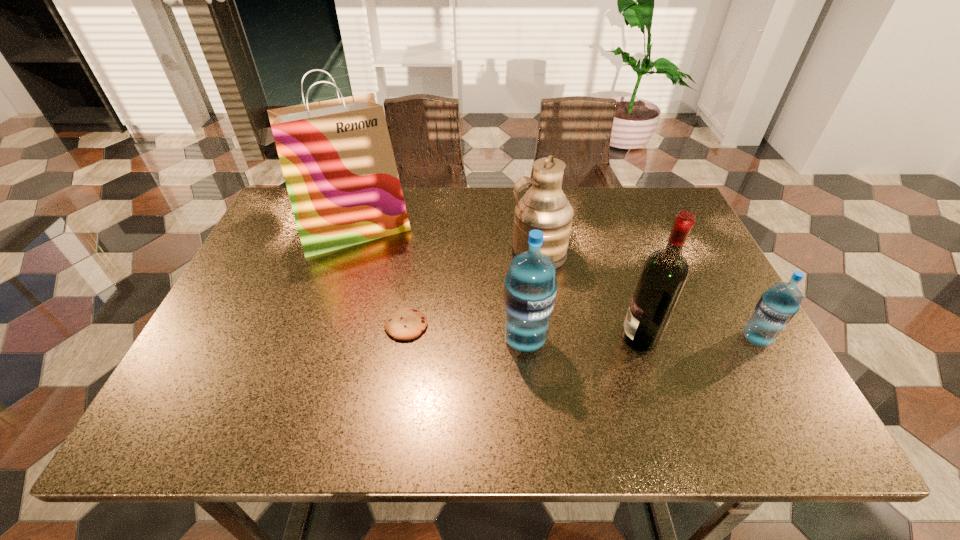
Where is `the left water bottle`? the left water bottle is located at coordinates (530, 288).

Where is `the rightmost object`? The height and width of the screenshot is (540, 960). the rightmost object is located at coordinates (776, 308).

The width and height of the screenshot is (960, 540). I want to click on the fifth tallest object, so click(x=776, y=308).

You are a GUI agent. You are given a task and a screenshot of the screen. Output one action in this format:
    pyautogui.click(x=<x>, y=<y>)
    Task: Click on the shopping bag
    This screenshot has width=960, height=540.
    Given the screenshot: What is the action you would take?
    pyautogui.click(x=336, y=155)

You are a GUI agent. You are given a task and a screenshot of the screen. Output one action in this format:
    pyautogui.click(x=<x>, y=<y>)
    Task: Click on the shortest object
    
    Given the screenshot: What is the action you would take?
    pyautogui.click(x=406, y=324)

At what (x,y) coordinates should I click in order to perform the action: click on pitcher. Please return your answer as a coordinate pair (x, y). The height and width of the screenshot is (540, 960). Looking at the image, I should click on (545, 207).

This screenshot has height=540, width=960. What are the coordinates of `the second object from right to left` in the screenshot? It's located at (664, 273).

This screenshot has width=960, height=540. What are the coordinates of `vacant region located on the left of the taller water bottle` in the screenshot? It's located at (326, 340).

The height and width of the screenshot is (540, 960). I want to click on vacant region located on the back of the right water bottle, so click(x=720, y=275).

You are a GUI agent. You are given a task and a screenshot of the screen. Output one action in this format:
    pyautogui.click(x=<x>, y=<y>)
    Task: Click on the free point located 0.200m on the front of the tallest object
    
    Given the screenshot: What is the action you would take?
    pyautogui.click(x=327, y=314)